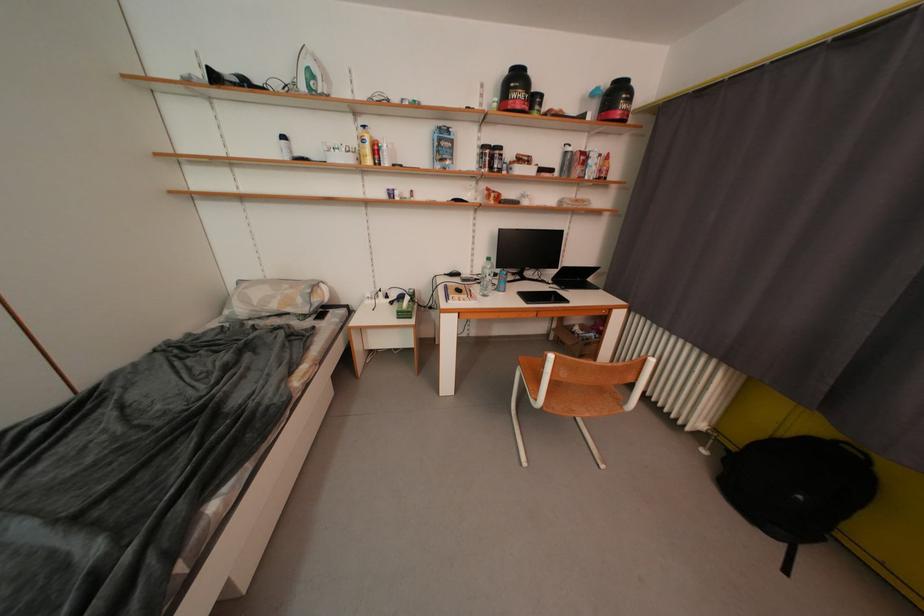
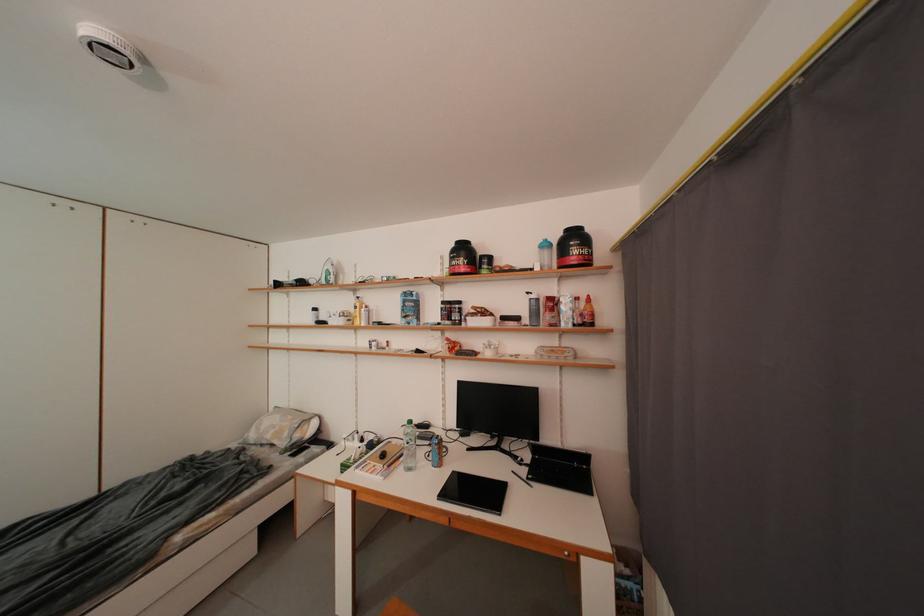
In the second image, find the point that corresponds to pixel 601 98 in the first image.

(553, 249)